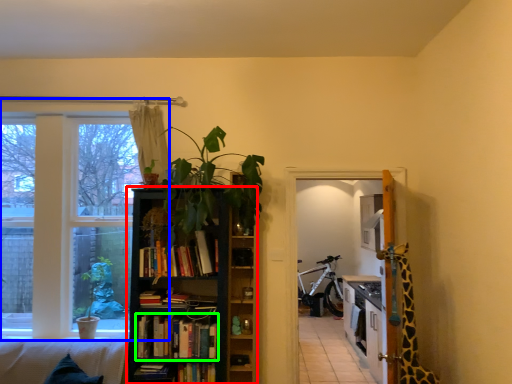
Question: Considering the real-world distances, which object is farthest from bookcase (highlighted by a red box)? window (highlighted by a blue box) or book (highlighted by a green box)?

Choices:
 (A) window
 (B) book

Answer: (A)